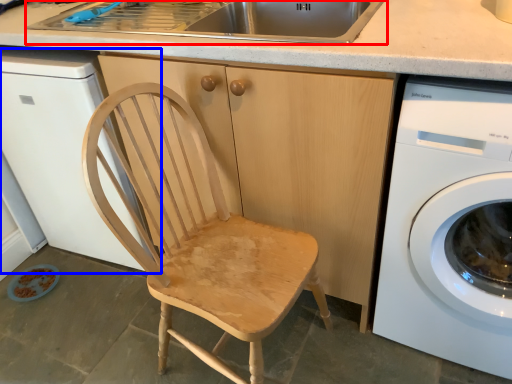
Question: Which object appears farthest to the camera in this image, sink (highlighted by a red box) or dish washer (highlighted by a blue box)?

Choices:
 (A) sink
 (B) dish washer

Answer: (A)